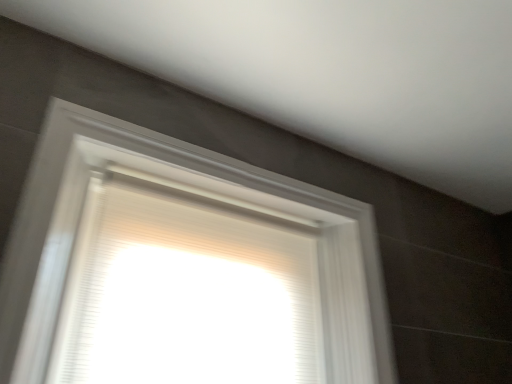
You are a GUI agent. You are given a task and a screenshot of the screen. Output one action in this format:
    pyautogui.click(x=<x>, y=<y>)
    Task: Click on the white textured frame at center
    Image resolution: width=512 pixels, height=384 pixels.
    Given the screenshot: What is the action you would take?
    pyautogui.click(x=183, y=268)

What is the approximate width of white textured frame at center?

The width of white textured frame at center is 26.07 centimeters.

Looking at this image, measure the distance between white textured frame at center and camera.

white textured frame at center is 28.88 inches from camera.

In order to face white textured frame at center, should I rotate leftwards or rightwards?

To align with it, rotate left about 4.494°.

Describe the element at coordinates (183, 268) in the screenshot. The width and height of the screenshot is (512, 384). I see `white textured frame at center` at that location.

Locate an element on the screen. white textured frame at center is located at coordinates (183, 268).